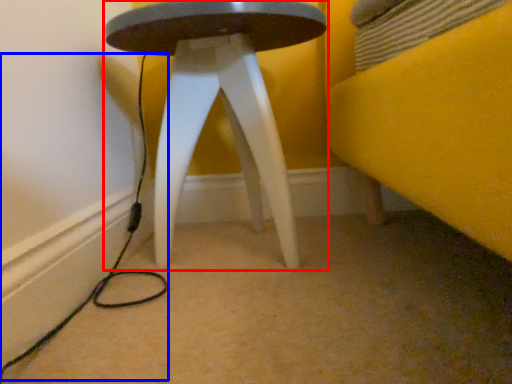
Question: Which object appears closest to the camera in this image, stool (highlighted by a red box) or cable (highlighted by a blue box)?

Choices:
 (A) stool
 (B) cable

Answer: (B)